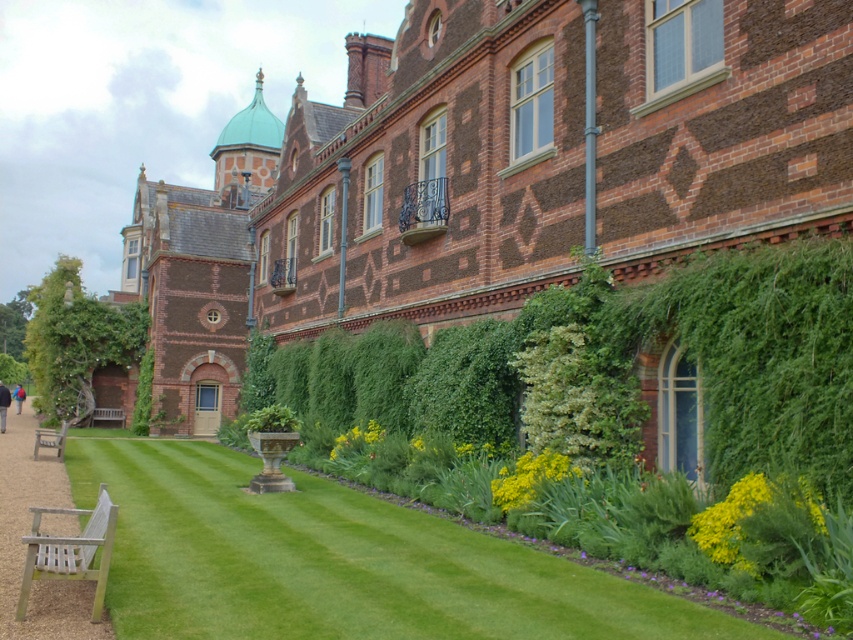
Can you confirm if green lawn at lower left is positioned above yellow-green leafy plant at lower right?

No, green lawn at lower left is not above yellow-green leafy plant at lower right.

Which is below, green lawn at lower left or yellow-green leafy plant at lower right?

green lawn at lower left

Which is in front, point (431, 532) or point (708, 541)?

Point (708, 541) is in front.

You are a GUI agent. You are given a task and a screenshot of the screen. Output one action in this format:
    pyautogui.click(x=<x>, y=<y>)
    Task: Click on the green lawn at lower left
    The width and height of the screenshot is (853, 640).
    Given the screenshot: What is the action you would take?
    pyautogui.click(x=337, y=561)

Which is more to the left, yellow matte flower at lower center or teak wood bench at lower left?

Positioned to the left is teak wood bench at lower left.

Can you confirm if yellow matte flower at lower center is positioned below teak wood bench at lower left?

Actually, yellow matte flower at lower center is above teak wood bench at lower left.

Is point (521, 492) closer to camera compared to point (119, 417)?

Yes, point (521, 492) is closer to viewer.

In order to click on yellow matte flower at lower center in this screenshot , I will do `click(527, 477)`.

Consider the image. Who is positioned more to the right, wooden slats bench at lower left or yellow matte flower at lower center?

yellow matte flower at lower center

Between wooden slats bench at lower left and yellow matte flower at lower center, which one has less height?

wooden slats bench at lower left is shorter.

At what (x,y) coordinates should I click in order to perform the action: click on wooden slats bench at lower left. Please return your answer as a coordinate pair (x, y). Looking at the image, I should click on (70, 552).